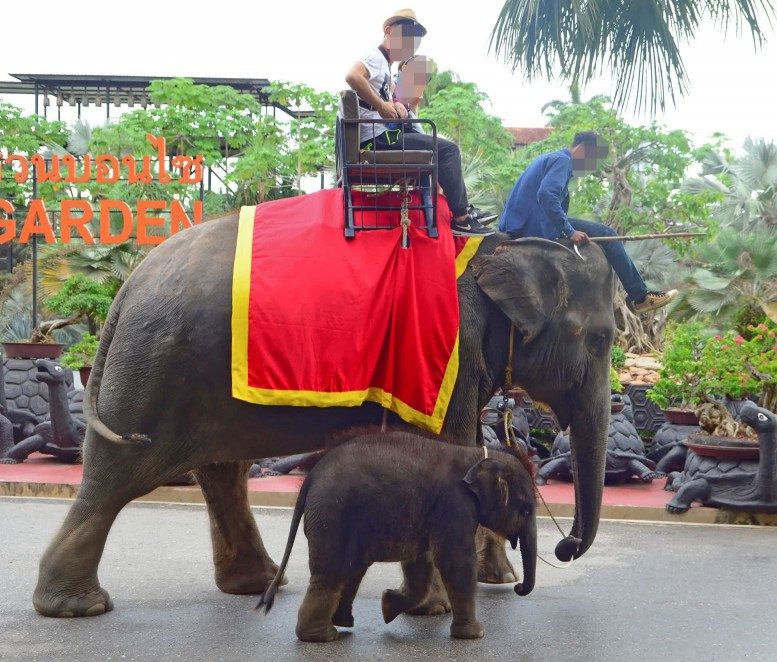
This screenshot has height=662, width=777. I want to click on chair saddle, so click(x=398, y=152).